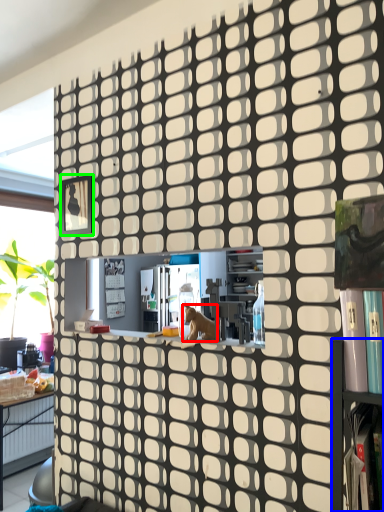
Question: Which object is positioned farthest from animal (highlighted by a red box)? Select from shelf (highlighted by a blue box) and square (highlighted by a green box).

Choices:
 (A) shelf
 (B) square

Answer: (B)